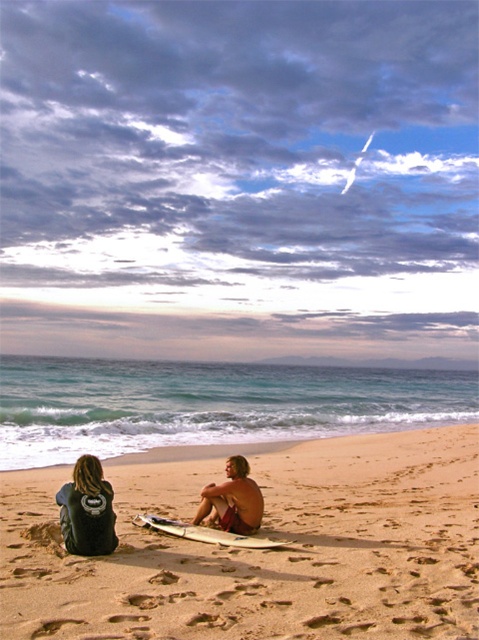
What are the coordinates of `matte black wetsuit at lower left` in the screenshot? It's located at (221, 512).

Where is `matte black wetsuit at lower left`? matte black wetsuit at lower left is located at coordinates (221, 512).

Does smooth sand surfboard at center have a greater width compared to black leather jacket at lower left?

Correct, the width of smooth sand surfboard at center exceeds that of black leather jacket at lower left.

Is point (392, 595) behind point (101, 504)?

No, (392, 595) is closer to viewer.

Locate an element on the screen. The width and height of the screenshot is (479, 640). smooth sand surfboard at center is located at coordinates (262, 550).

Is black leather jacket at lower left positioned in front of white glossy surfboard at center?

That is True.

Who is taller, black leather jacket at lower left or white glossy surfboard at center?

With more height is black leather jacket at lower left.

Between point (76, 508) and point (159, 524), which one is positioned in front?

Point (76, 508) is more forward.

Where is `black leather jacket at lower left`? This screenshot has height=640, width=479. black leather jacket at lower left is located at coordinates (87, 509).